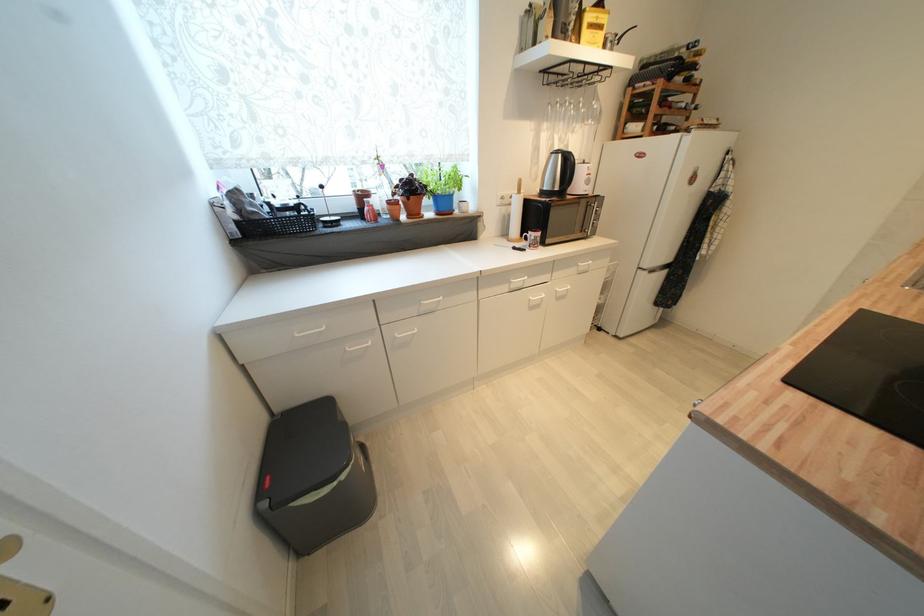
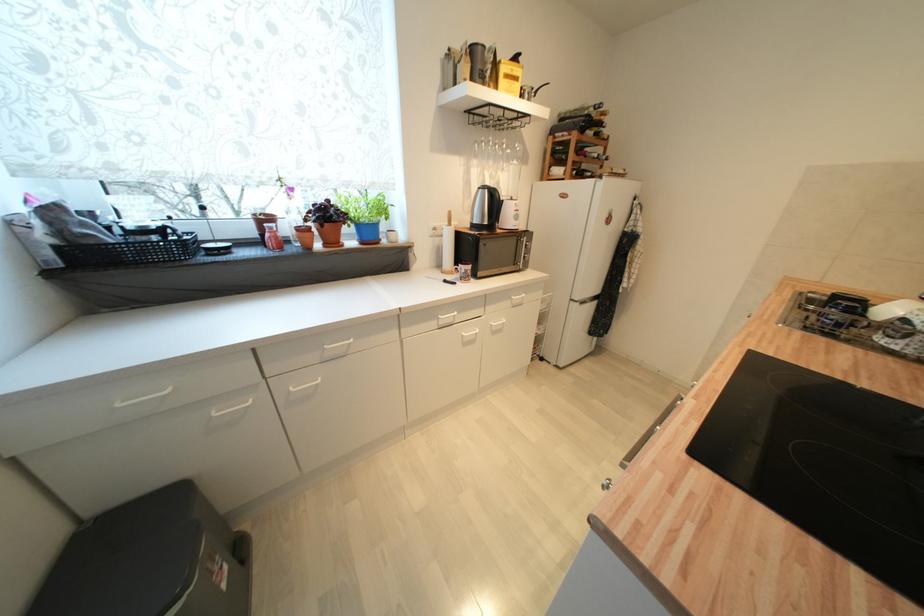
Find the pixel in the second image that matches [562,154] in the first image.

(489, 188)